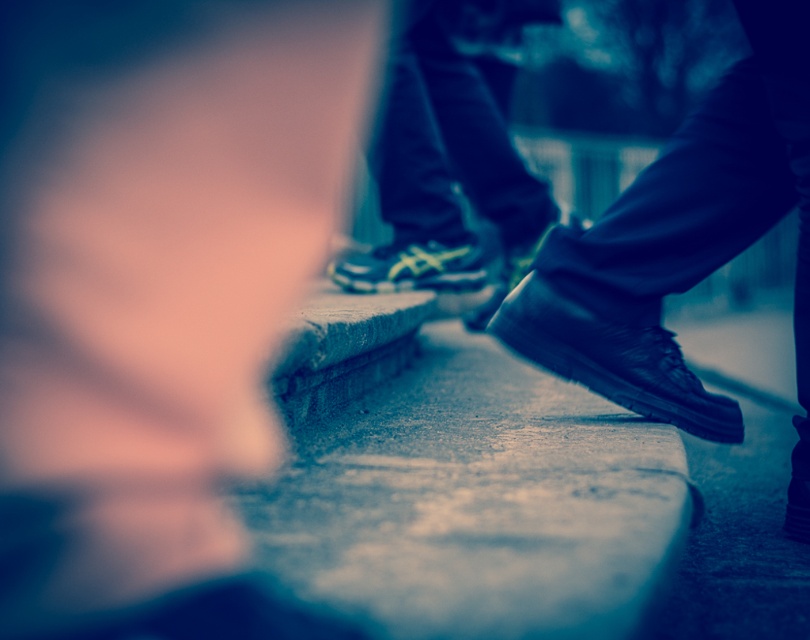
Question: Among these objects, which one is nearest to the camera?

Choices:
 (A) black leather shoe at center
 (B) white mesh shoe at center

Answer: (A)

Question: Which is nearer to the black leather shoe at center?

Choices:
 (A) black leather shoe at lower right
 (B) white mesh shoe at center

Answer: (B)

Question: Does black leather shoe at lower right have a larger size compared to white mesh shoe at center?

Choices:
 (A) yes
 (B) no

Answer: (B)

Question: Can you confirm if black leather shoe at lower right is positioned below white mesh shoe at center?

Choices:
 (A) yes
 (B) no

Answer: (A)

Question: Is white mesh shoe at center to the left of black leather shoe at center from the viewer's perspective?

Choices:
 (A) yes
 (B) no

Answer: (A)

Question: Which point is closer to the camera?

Choices:
 (A) black leather shoe at center
 (B) white mesh shoe at center

Answer: (A)